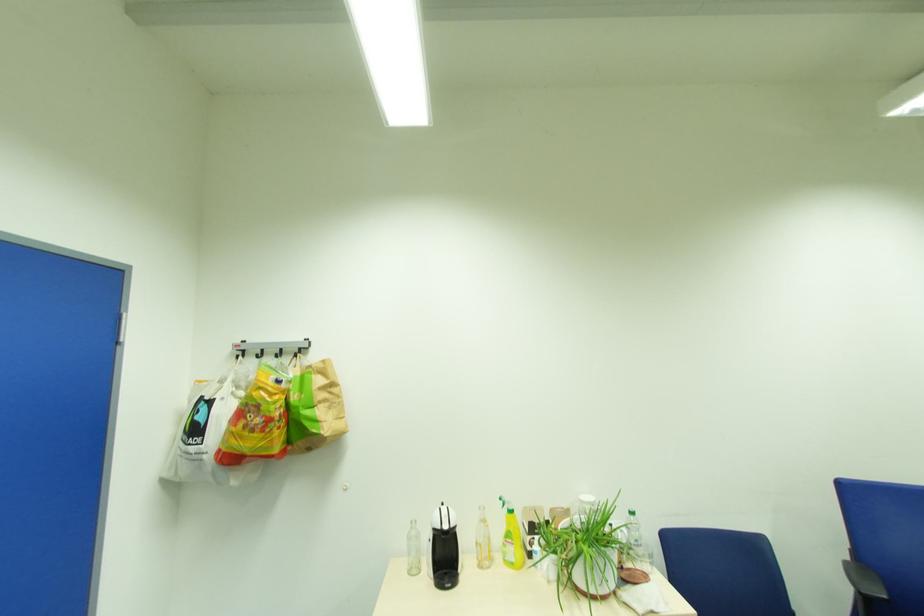
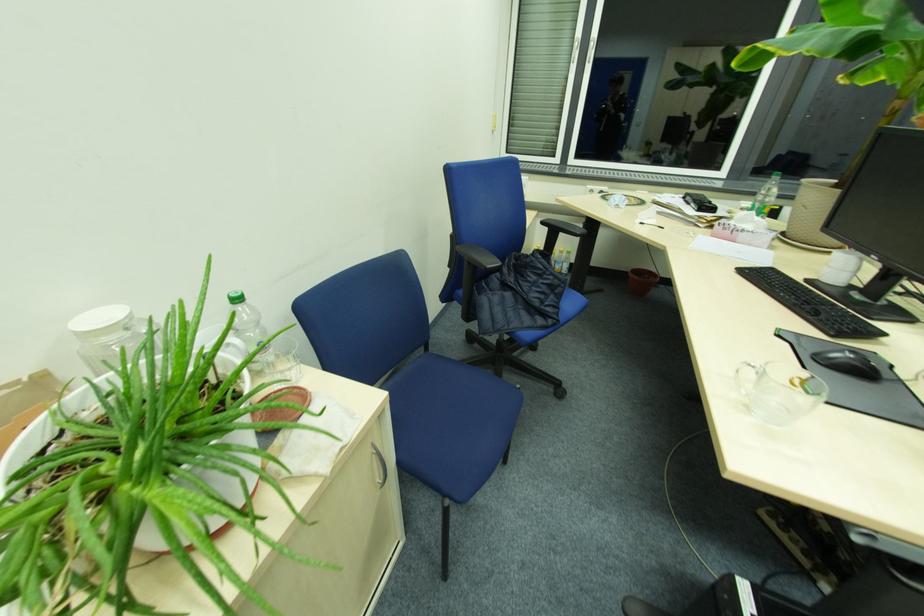
In the second image, find the point that corresponds to point 637,512 in the first image.

(237, 298)